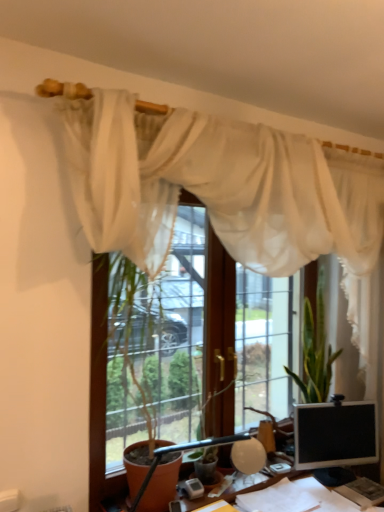
Question: Considering the relative positions of matte black table lamp at center and wooden desk at lower center in the image provided, is matte black table lamp at center to the right of wooden desk at lower center from the viewer's perspective?

Choices:
 (A) yes
 (B) no

Answer: (B)

Question: From the image's perspective, is matte black table lamp at center over wooden desk at lower center?

Choices:
 (A) yes
 (B) no

Answer: (A)

Question: From a real-world perspective, is matte black table lamp at center on wooden desk at lower center?

Choices:
 (A) yes
 (B) no

Answer: (A)

Question: Does matte black table lamp at center come in front of wooden desk at lower center?

Choices:
 (A) yes
 (B) no

Answer: (B)

Question: Does matte black table lamp at center touch wooden desk at lower center?

Choices:
 (A) yes
 (B) no

Answer: (B)

Question: From a real-world perspective, is matte black table lamp at center below wooden desk at lower center?

Choices:
 (A) no
 (B) yes

Answer: (A)

Question: Is matte black table lamp at center bigger than matte black monitor at lower right?

Choices:
 (A) yes
 (B) no

Answer: (B)

Question: Considering the relative sizes of matte black table lamp at center and matte black monitor at lower right in the image provided, is matte black table lamp at center taller than matte black monitor at lower right?

Choices:
 (A) no
 (B) yes

Answer: (A)

Question: Is matte black table lamp at center positioned behind matte black monitor at lower right?

Choices:
 (A) no
 (B) yes

Answer: (A)

Question: Can you confirm if matte black table lamp at center is positioned to the left of matte black monitor at lower right?

Choices:
 (A) no
 (B) yes

Answer: (B)

Question: Is matte black monitor at lower right surrounded by matte black table lamp at center?

Choices:
 (A) no
 (B) yes

Answer: (A)

Question: Considering the relative positions of matte black table lamp at center and matte black monitor at lower right in the image provided, is matte black table lamp at center to the right of matte black monitor at lower right from the viewer's perspective?

Choices:
 (A) no
 (B) yes

Answer: (A)

Question: Can you confirm if sheer white curtain at upper center is thinner than matte black monitor at lower right?

Choices:
 (A) yes
 (B) no

Answer: (B)